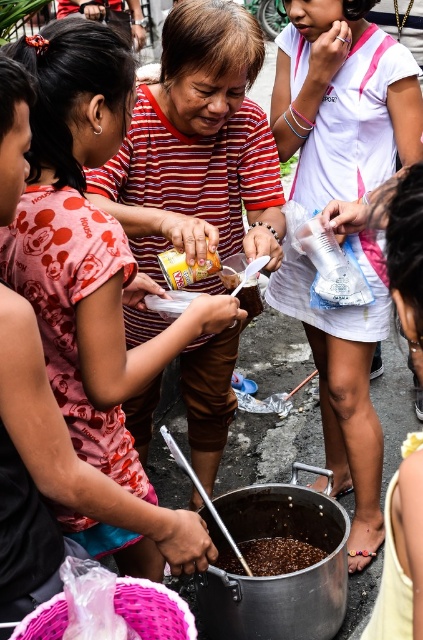
Question: Based on their relative distances, which object is nearer to the striped fabric shirt at center?

Choices:
 (A) brown matte rice at center
 (B) white cotton shirt at center

Answer: (B)

Question: Which of the following is the farthest from the observer?

Choices:
 (A) (167, 122)
 (B) (305, 152)
 (C) (252, 554)

Answer: (B)

Question: Is the position of white cotton shirt at center less distant than that of brown matte rice at center?

Choices:
 (A) yes
 (B) no

Answer: (A)

Question: From the image, what is the correct spatial relationship of striped fabric shirt at center in relation to white cotton shirt at center?

Choices:
 (A) left
 (B) right

Answer: (A)

Question: Which point is farther to the camera?

Choices:
 (A) striped fabric shirt at center
 (B) brown matte rice at center
 (C) white cotton shirt at center

Answer: (B)

Question: Is striped fabric shirt at center positioned in front of brown matte rice at center?

Choices:
 (A) no
 (B) yes

Answer: (B)